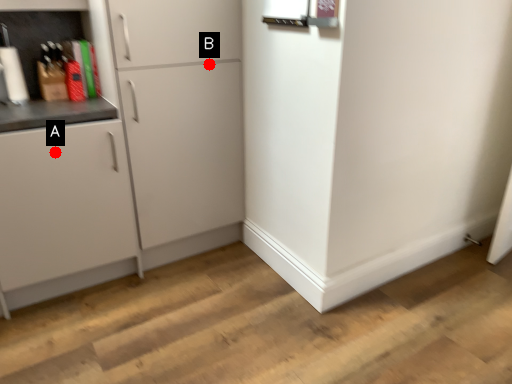
Question: Two points are circled on the image, labeled by A and B beside each circle. Which point is closer to the camera taking this photo?

Choices:
 (A) A is closer
 (B) B is closer

Answer: (A)